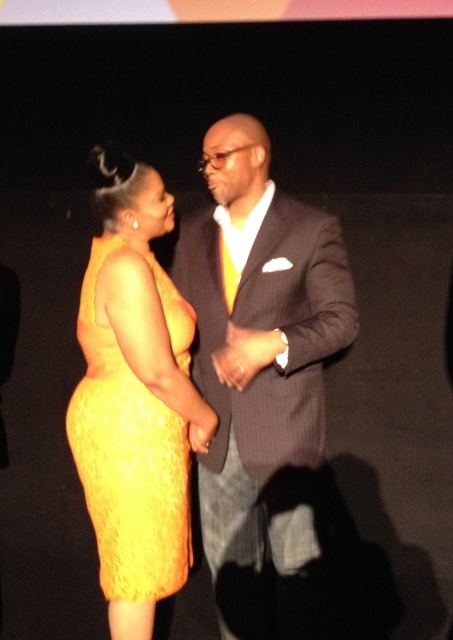
Does matte black suit at center have a lesser width compared to yellow lace dress at left?

In fact, matte black suit at center might be wider than yellow lace dress at left.

Who is more forward, (275,497) or (88,305)?

Point (88,305) is in front.

Between point (273, 381) and point (115, 236), which one is positioned in front?

Positioned in front is point (273, 381).

This screenshot has height=640, width=453. What are the coordinates of `matte black suit at center` in the screenshot? It's located at [263, 380].